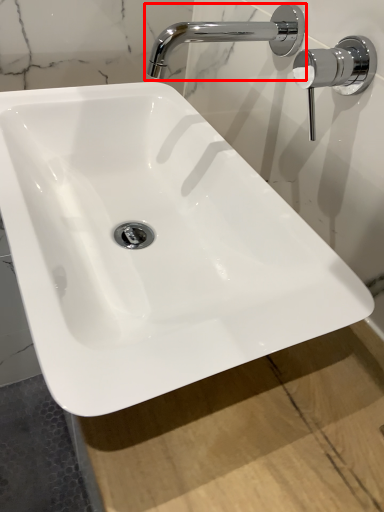
Question: In this image, where is tap (annotated by the red box) located relative to door handle?

Choices:
 (A) left
 (B) right

Answer: (A)